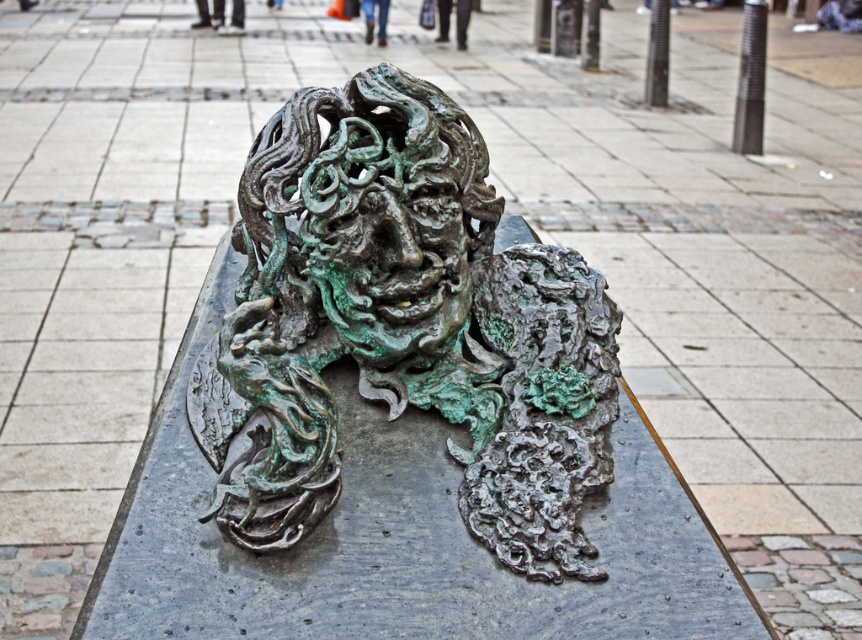
Question: Which object is farther from the camera taking this photo?

Choices:
 (A) green patina bronze face at center
 (B) green patina bronze sculpture at center

Answer: (A)

Question: In this image, where is green patina bronze sculpture at center located relative to green patina bronze face at center?

Choices:
 (A) right
 (B) left

Answer: (B)

Question: Can you confirm if green patina bronze sculpture at center is bigger than green patina bronze face at center?

Choices:
 (A) yes
 (B) no

Answer: (A)

Question: Among these points, which one is nearest to the camera?

Choices:
 (A) (453, 301)
 (B) (283, 125)

Answer: (A)

Question: In this image, where is green patina bronze sculpture at center located relative to green patina bronze face at center?

Choices:
 (A) right
 (B) left

Answer: (B)